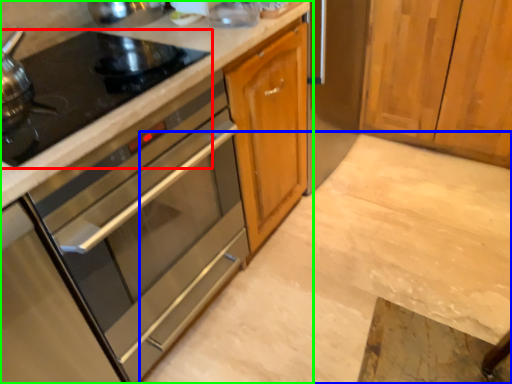
Question: Which object is the closest to the gas stove (highlighted by a red box)? Choose among these: concrete (highlighted by a blue box) or cabinetry (highlighted by a green box).

Choices:
 (A) concrete
 (B) cabinetry

Answer: (B)